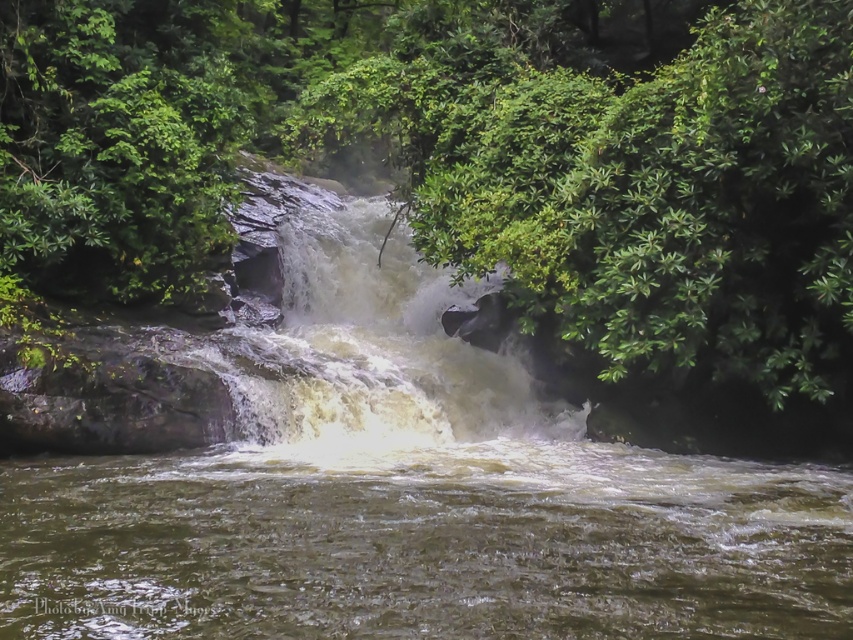
Question: Where is green leafy tree at center located in relation to white frothy water at center in the image?

Choices:
 (A) right
 (B) left

Answer: (B)

Question: Can you confirm if green leafy tree at center is positioned to the left of white frothy water at center?

Choices:
 (A) no
 (B) yes

Answer: (B)

Question: Is green leafy tree at center positioned in front of white frothy water at center?

Choices:
 (A) no
 (B) yes

Answer: (B)

Question: Which object appears closest to the camera in this image?

Choices:
 (A) white frothy water at center
 (B) green leafy tree at center

Answer: (B)

Question: Among these points, which one is nearest to the camera?

Choices:
 (A) (15, 214)
 (B) (413, 292)

Answer: (A)